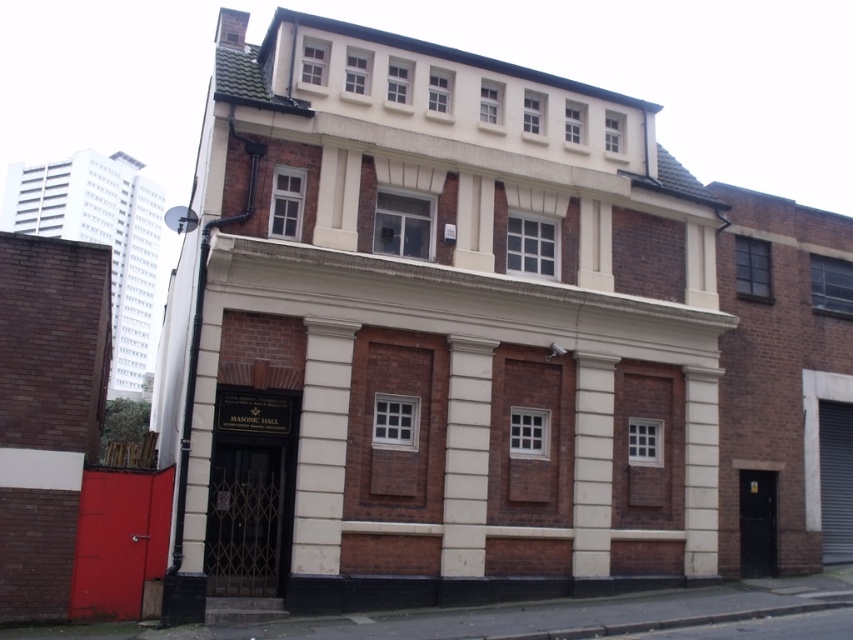
Question: Can you confirm if white smooth column at center is bigger than smooth white column at center?

Choices:
 (A) no
 (B) yes

Answer: (A)

Question: Does white smooth column at center have a lesser width compared to white smooth pillar at center?

Choices:
 (A) no
 (B) yes

Answer: (B)

Question: Among these points, which one is farthest from the camera?

Choices:
 (A) (486, 371)
 (B) (703, 499)

Answer: (B)

Question: Which point is closer to the camera?

Choices:
 (A) white smooth pillar at center
 (B) smooth white column at center

Answer: (B)

Question: Which point appears closest to the camera in this image?

Choices:
 (A) (601, 474)
 (B) (482, 360)
 (C) (689, 381)

Answer: (B)

Question: Is white smooth column at center to the left of smooth white column at center from the viewer's perspective?

Choices:
 (A) yes
 (B) no

Answer: (A)